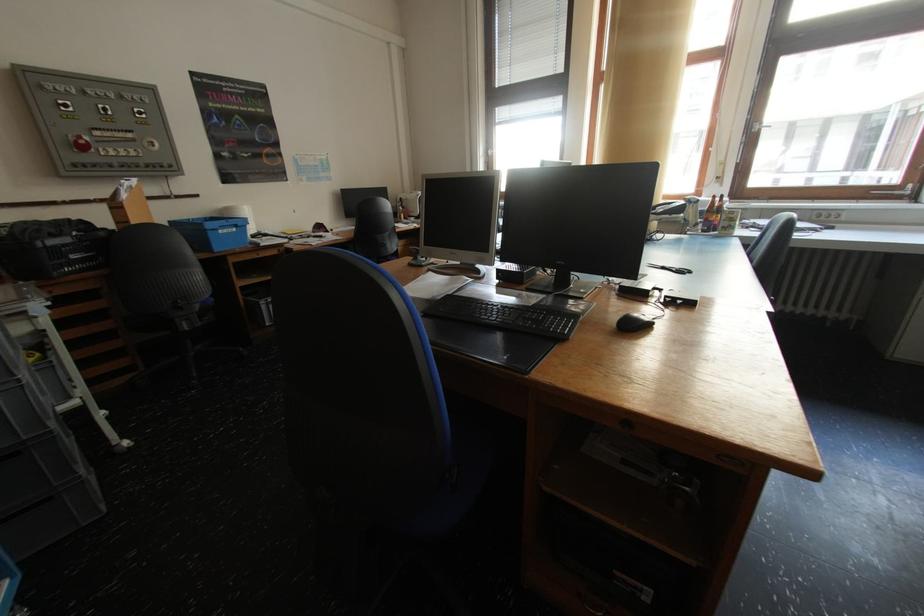
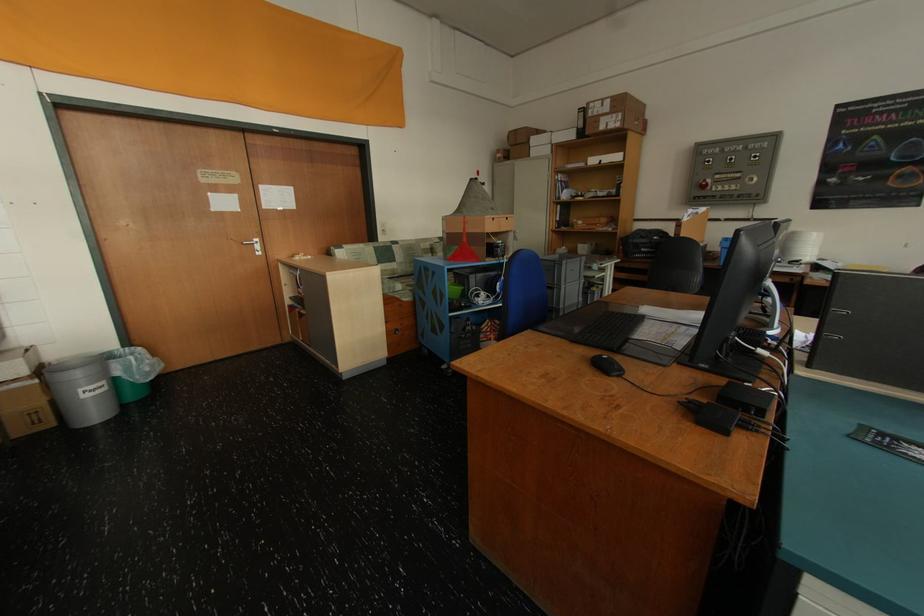
In the second image, find the point that corresponds to (80,140) in the first image.

(709, 183)